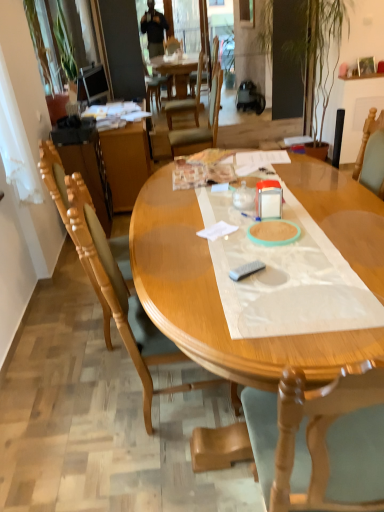
Identify the location of vacant space in front of metallic silver container at center. (289, 238).